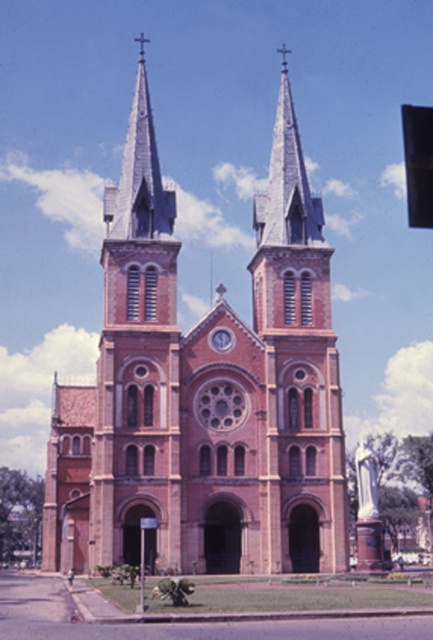
Question: Can you confirm if black plastic traffic light at upper right is positioned to the right of matte brown clock at center?

Choices:
 (A) no
 (B) yes

Answer: (B)

Question: Is red brick church at center behind matte brown clock at center?

Choices:
 (A) no
 (B) yes

Answer: (A)

Question: Which point is farther from the camera taking this photo?

Choices:
 (A) (90, 520)
 (B) (215, 337)
 (C) (265, 508)
 (D) (422, 202)

Answer: (B)

Question: Which point is closer to the camera taking this photo?

Choices:
 (A) (104, 413)
 (B) (423, 108)
 (C) (220, 339)

Answer: (A)

Question: Based on their relative distances, which object is farther from the black plastic traffic light at upper right?

Choices:
 (A) red brick church at center
 (B) matte brown clock at center
 (C) smooth gray steeple at center

Answer: (B)

Question: Considering the relative positions of red brick church at center and matte brown clock at center in the image provided, where is red brick church at center located with respect to matte brown clock at center?

Choices:
 (A) left
 (B) right

Answer: (A)